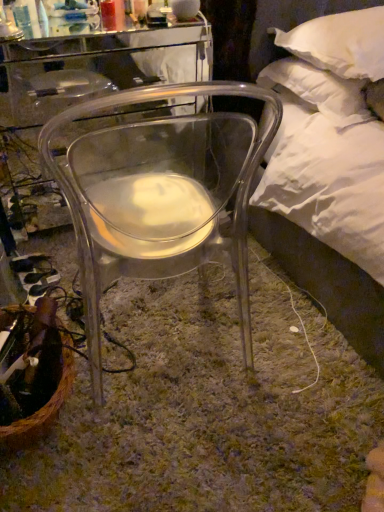
Question: Does transparent plastic chair at center have a lesser width compared to white soft pillow at upper right, the first pillow positioned from the top?

Choices:
 (A) no
 (B) yes

Answer: (A)

Question: Can you confirm if transparent plastic chair at center is wider than white soft pillow at upper right, the first pillow positioned from the top?

Choices:
 (A) yes
 (B) no

Answer: (A)

Question: Considering the relative sizes of transparent plastic chair at center and white soft pillow at upper right, arranged as the second pillow when ordered from the bottom, in the image provided, is transparent plastic chair at center taller than white soft pillow at upper right, arranged as the second pillow when ordered from the bottom,?

Choices:
 (A) yes
 (B) no

Answer: (A)

Question: Can we say transparent plastic chair at center lies outside white soft pillow at upper right, the first pillow positioned from the top?

Choices:
 (A) no
 (B) yes

Answer: (B)

Question: From the image's perspective, is transparent plastic chair at center over white soft pillow at upper right, the first pillow positioned from the top?

Choices:
 (A) yes
 (B) no

Answer: (B)

Question: Is white soft pillow at upper right, which is the first pillow in bottom-to-top order, in front of or behind brown woven basket at lower left in the image?

Choices:
 (A) front
 (B) behind

Answer: (B)

Question: Is white soft pillow at upper right, marked as the second pillow in a top-to-bottom arrangement, wider or thinner than brown woven basket at lower left?

Choices:
 (A) thin
 (B) wide

Answer: (B)

Question: In the image, is white soft pillow at upper right, which is the first pillow in bottom-to-top order, on the left side or the right side of brown woven basket at lower left?

Choices:
 (A) left
 (B) right

Answer: (B)

Question: Is point (345, 105) positioned closer to the camera than point (59, 394)?

Choices:
 (A) farther
 (B) closer

Answer: (A)

Question: From their relative heights in the image, would you say brown woven basket at lower left is taller or shorter than white soft pillow at upper right, which is the first pillow in bottom-to-top order?

Choices:
 (A) short
 (B) tall

Answer: (B)

Question: Is point (38, 431) positioned closer to the camera than point (326, 117)?

Choices:
 (A) farther
 (B) closer

Answer: (B)

Question: Choose the correct answer: Is brown woven basket at lower left inside white soft pillow at upper right, marked as the second pillow in a top-to-bottom arrangement, or outside it?

Choices:
 (A) inside
 (B) outside

Answer: (B)

Question: From a real-world perspective, is brown woven basket at lower left positioned above or below white soft pillow at upper right, marked as the second pillow in a top-to-bottom arrangement?

Choices:
 (A) above
 (B) below

Answer: (B)

Question: In terms of height, does transparent plastic chair at center look taller or shorter compared to white soft pillow at upper right, marked as the second pillow in a top-to-bottom arrangement?

Choices:
 (A) tall
 (B) short

Answer: (A)

Question: Considering the positions of transparent plastic chair at center and white soft pillow at upper right, marked as the second pillow in a top-to-bottom arrangement, in the image, is transparent plastic chair at center wider or thinner than white soft pillow at upper right, marked as the second pillow in a top-to-bottom arrangement,?

Choices:
 (A) wide
 (B) thin

Answer: (A)